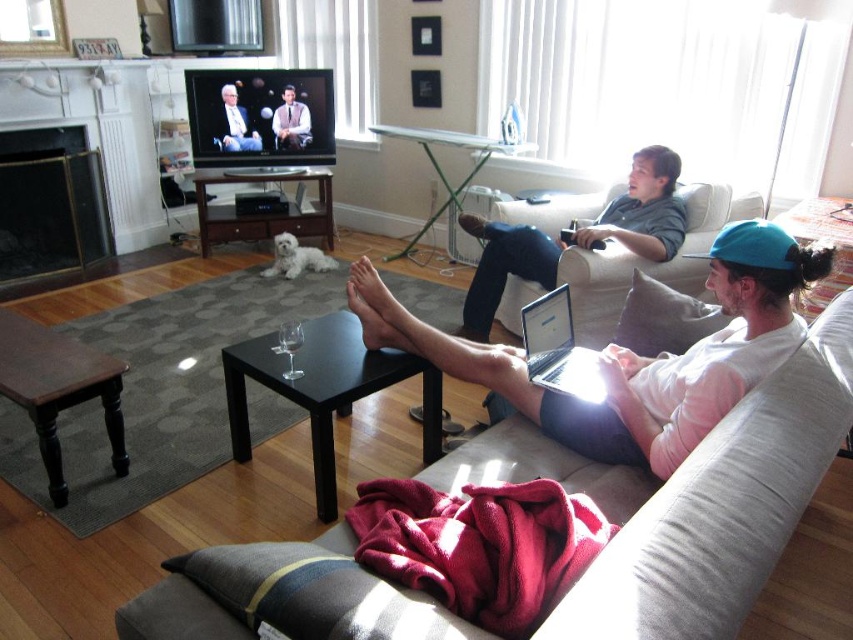
Question: From the image, what is the correct spatial relationship of matte gray shirt at center in relation to silver metallic laptop at center?

Choices:
 (A) below
 (B) above

Answer: (B)

Question: Among these objects, which one is nearest to the camera?

Choices:
 (A) smooth black suit at center
 (B) matte black suit at center
 (C) silver metallic laptop at center

Answer: (C)

Question: Is matte gray shirt at center to the right of matte black suit at center from the viewer's perspective?

Choices:
 (A) yes
 (B) no

Answer: (A)

Question: Is gray fabric couch at lower right wider than matte black suit at center?

Choices:
 (A) yes
 (B) no

Answer: (A)

Question: Which object is farther from the camera taking this photo?

Choices:
 (A) smooth black suit at center
 (B) matte gray shirt at center
 (C) black metal fireplace at left

Answer: (A)

Question: Which point is closer to the camera taking this photo?

Choices:
 (A) (515, 243)
 (B) (10, 248)
 (C) (251, 129)

Answer: (A)